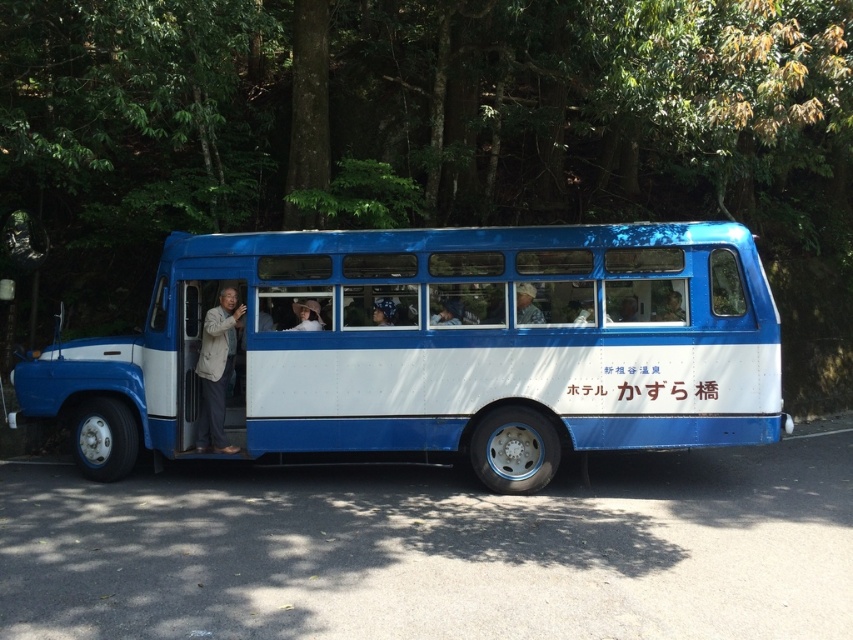
You are a photographer standing on the road and want to capture both the blue matte bus at center and the beige fabric jacket at left in a single frame. Considering their sizes, which object should you focus on to ensure both fit in the frame?

The blue matte bus at center is wider than the beige fabric jacket at left, so focusing on the bus will ensure both objects fit in the frame as it takes up more space.

You are a photographer standing on the road near the vintage blue and white bus. You want to take a photo that includes both the blue matte bus at center and the beige fabric jacket at left. Which object should you zoom in on to make both fit in the frame?

The blue matte bus at center is smaller than the beige fabric jacket at left, so you should zoom in on the beige fabric jacket at left to ensure both objects fit in the frame.